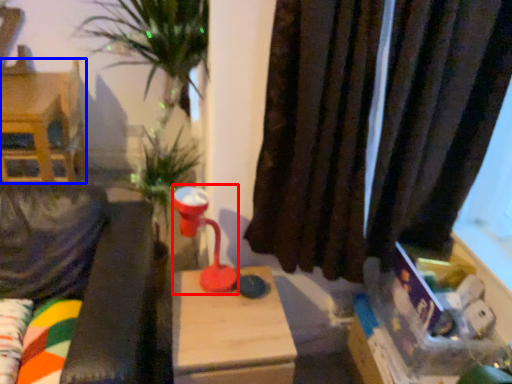
Question: Which object appears farthest to the camera in this image, table lamp (highlighted by a red box) or furniture (highlighted by a blue box)?

Choices:
 (A) table lamp
 (B) furniture

Answer: (B)